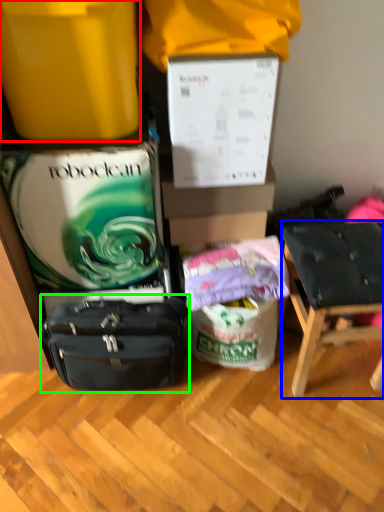
Question: Based on their relative distances, which object is farther from box (highlighted by a red box)? Choose from chair (highlighted by a blue box) and luggage and bags (highlighted by a green box).

Choices:
 (A) chair
 (B) luggage and bags

Answer: (A)